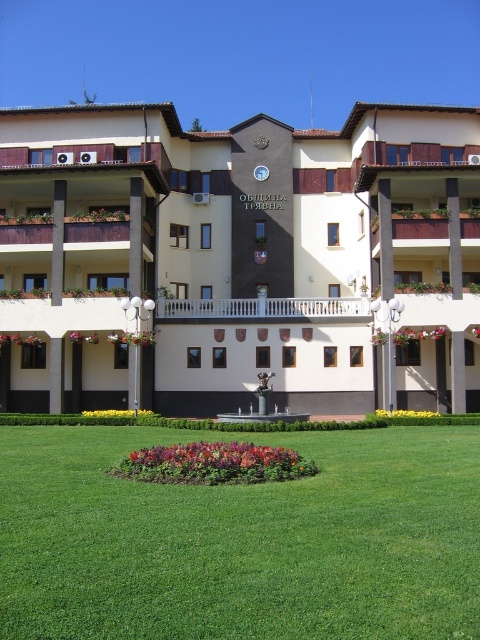
Which of these two, beige concrete building at center or green grass at center, stands shorter?

green grass at center

Who is more forward, (335,355) or (313,451)?

Positioned in front is point (313,451).

Measure the distance between beige concrete building at center and camera.

The distance of beige concrete building at center from camera is 147.75 feet.

Where is `beige concrete building at center`? The height and width of the screenshot is (640, 480). beige concrete building at center is located at coordinates (240, 259).